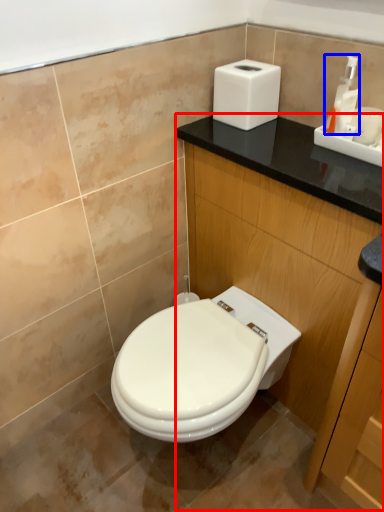
Question: Among these objects, which one is farthest to the camera, dresser (highlighted by a red box) or soap dispenser (highlighted by a blue box)?

Choices:
 (A) dresser
 (B) soap dispenser

Answer: (B)